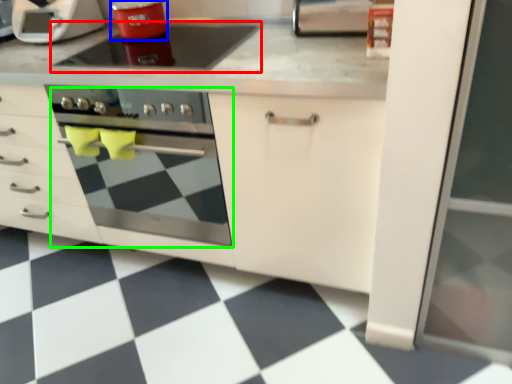
Question: Considering the real-world distances, which object is farthest from gas stove (highlighted by a red box)? kitchen appliance (highlighted by a blue box) or oven (highlighted by a green box)?

Choices:
 (A) kitchen appliance
 (B) oven

Answer: (B)